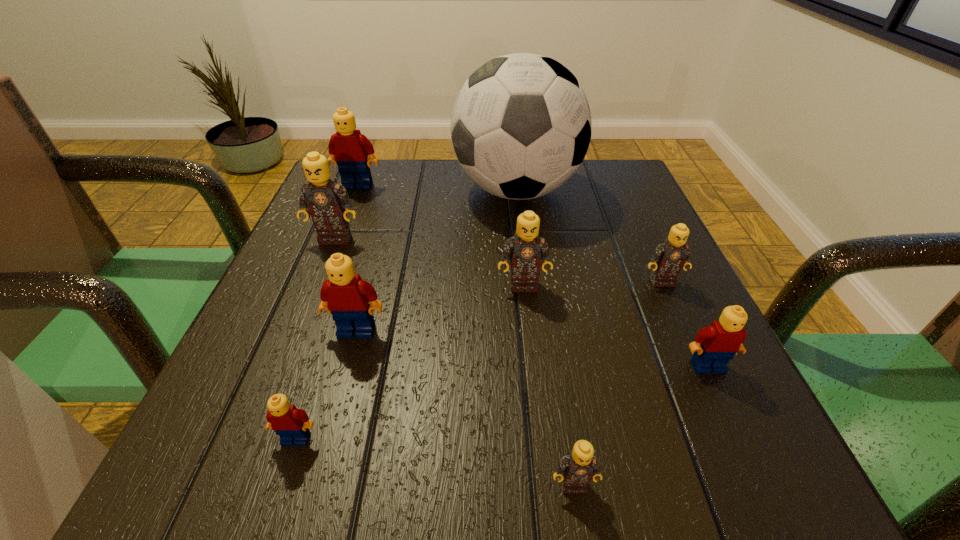
The width and height of the screenshot is (960, 540). Identify the location of free space located 0.070m in front of the leftmost tan Lego. (323, 268).

This screenshot has height=540, width=960. In order to click on vacant space situated 0.190m in front of the third smallest tan Lego in this screenshot , I will do `click(534, 386)`.

Find the location of a particular element. This screenshot has height=540, width=960. vacant space located on the front-facing side of the fourth nearest object is located at coordinates (325, 444).

This screenshot has width=960, height=540. Identify the location of vacant point located in front of the rightmost tan Lego. (736, 444).

Image resolution: width=960 pixels, height=540 pixels. I want to click on free spot located 0.170m on the front-facing side of the seventh farthest object, so click(769, 497).

Locate an element on the screen. This screenshot has height=540, width=960. vacant space located on the front-facing side of the nearest yellow Lego is located at coordinates (280, 488).

Locate an element on the screen. soccer ball present at the far edge is located at coordinates (521, 126).

You are a GUI agent. You are given a task and a screenshot of the screen. Output one action in this format:
    pyautogui.click(x=<x>, y=<y>)
    Task: Click on the Lego that is at the far edge
    
    Given the screenshot: What is the action you would take?
    pyautogui.click(x=349, y=149)

Locate an element on the screen. The image size is (960, 540). soccer ball positioned at the right edge is located at coordinates (521, 126).

At what (x,y) coordinates should I click in order to perform the action: click on object located at the far left corner. Please return your answer as a coordinate pair (x, y). Looking at the image, I should click on [349, 149].